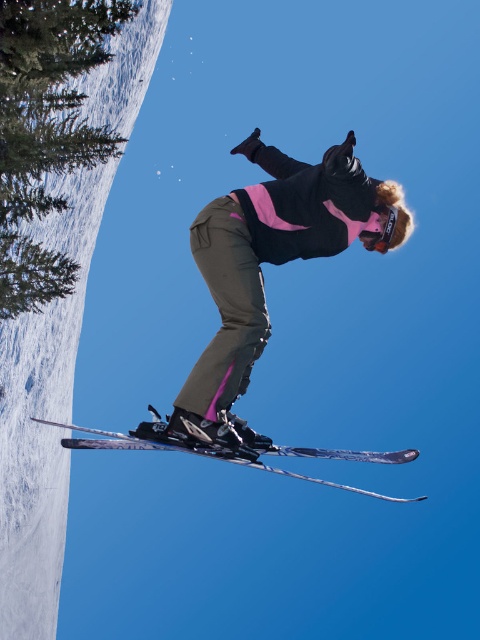
In the scene shown: You are a photographer trying to capture the skier in midair. You notice the matte black ski suit at center and the shiny metallic skis at center. Which object should you focus on first if you want to ensure the larger object is in sharp focus?

The matte black ski suit at center is larger in size than the shiny metallic skis at center, so you should focus on the matte black ski suit at center first to ensure the larger object is in sharp focus.

You are a photographer trying to capture the skier in midair. You notice the matte black ski suit at center and the shiny metallic skis at center. Which object should you focus on first if you want to ensure both are in frame without moving the camera?

The matte black ski suit at center is wider than the shiny metallic skis at center, so focusing on the wider matte black ski suit at center first would help ensure both are in frame without needing to adjust the camera position.

You are a photographer trying to capture the skier in midair. You notice the matte black ski suit at center and the shiny metallic skis at center. Which object should you focus on first to ensure the skier is sharp in the photo?

The matte black ski suit at center is in front of the shiny metallic skis at center, so you should focus on the matte black ski suit at center first to ensure the skier is sharp in the photo.